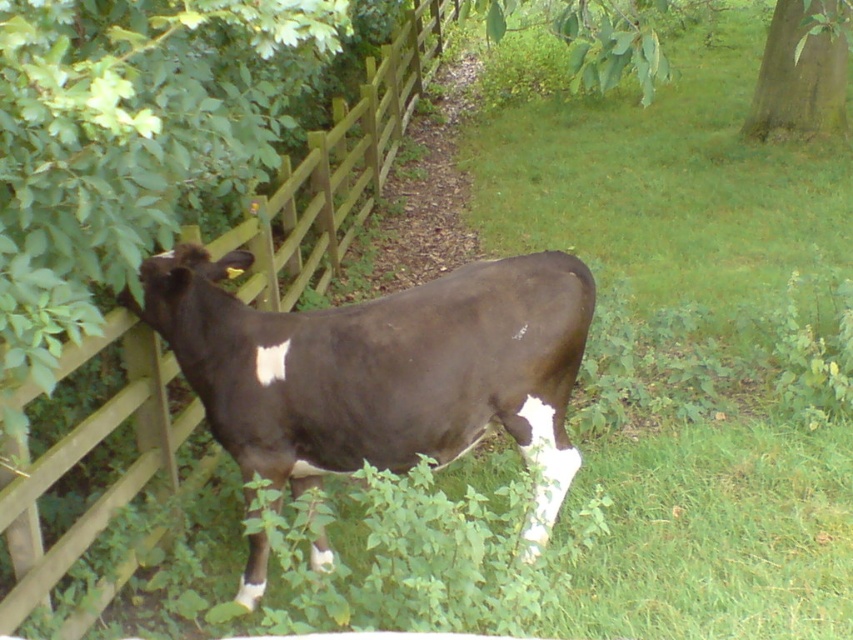
You are a photographer trying to capture both the dark brown cow at center and the wooden at left in a single frame. Based on their sizes in the image, which one would you need to move closer to or further away from to ensure both are clearly visible?

The dark brown cow at center occupies less space than the wooden at left, so you would need to move closer to the dark brown cow at center to make it larger in the frame while moving away from the wooden at left to reduce its size, ensuring both are clearly visible.

You are standing at the point marked as point (381, 368) in the image. What object are you currently standing on?

You are standing on the dark brown cow at center because the point (381, 368) is located on it.